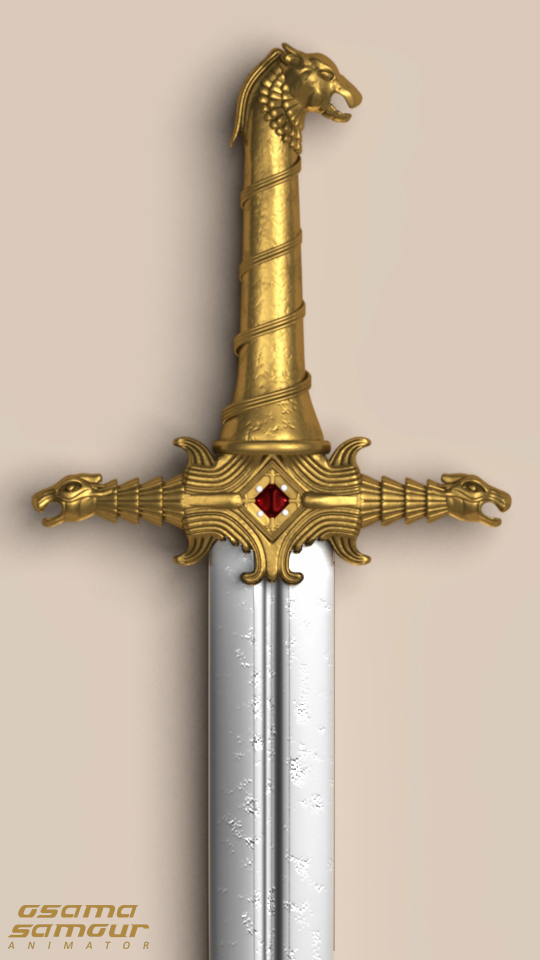
I want to click on animal heads, so (x=317, y=81), (x=465, y=507), (x=36, y=502).